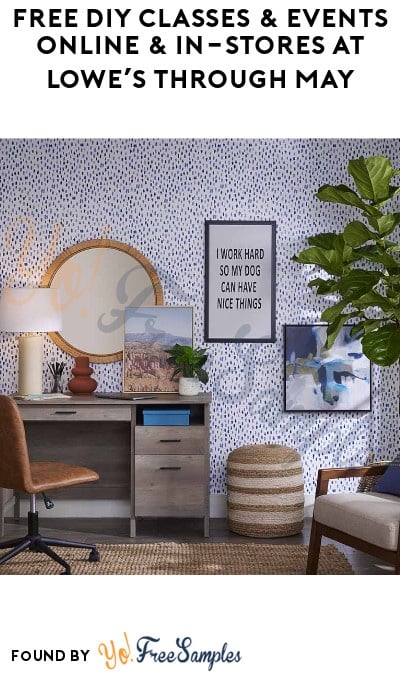
Find the location of `wall`. wall is located at coordinates (153, 209), (248, 403).